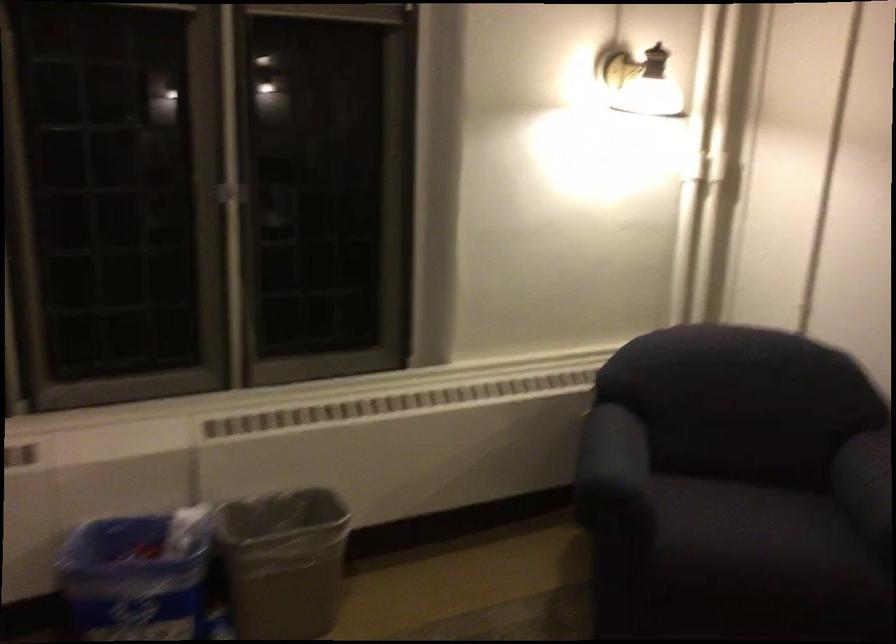
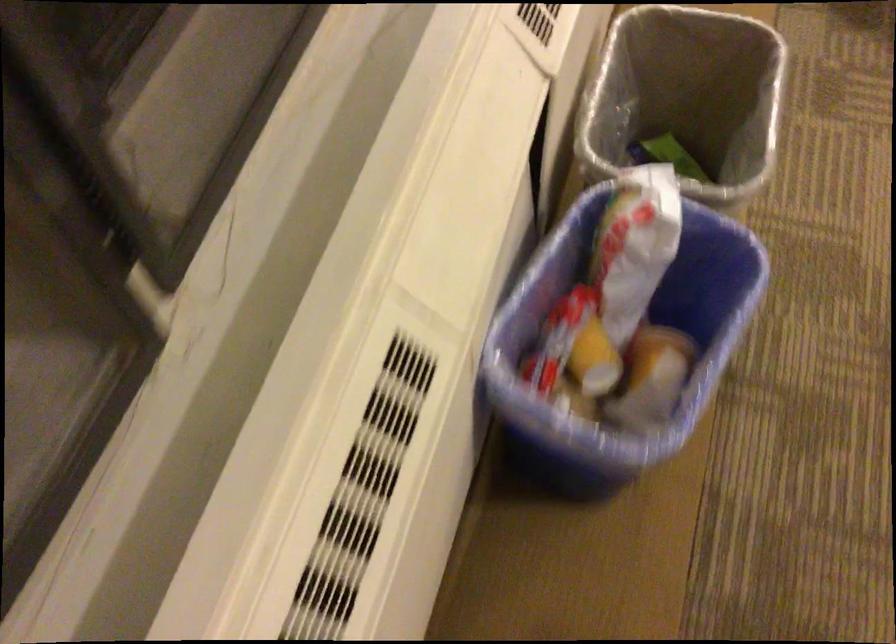
In the second image, find the point that corresponds to (343,551) in the first image.

(686, 97)